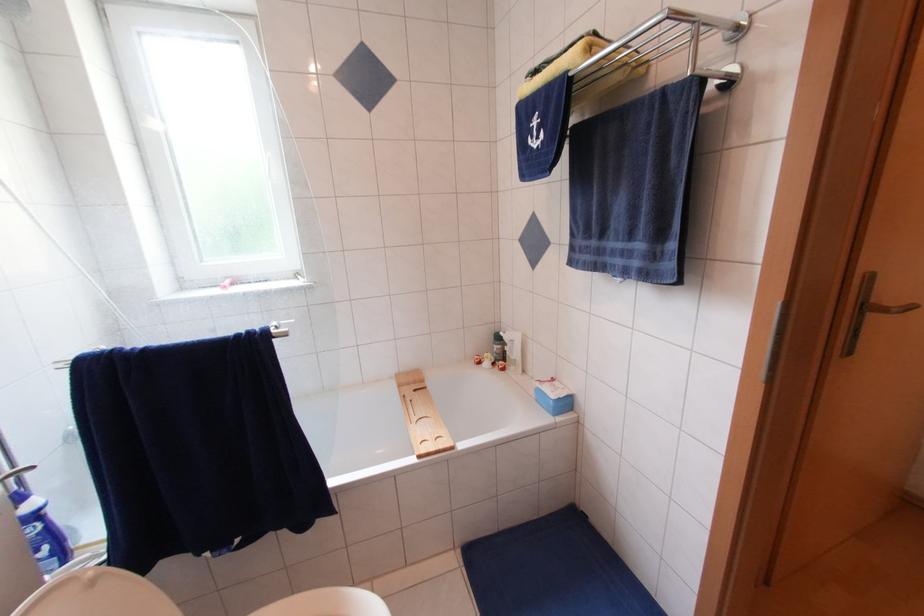
Image resolution: width=924 pixels, height=616 pixels. What are the coordinates of `metal door handle` in the screenshot? It's located at (891, 309).